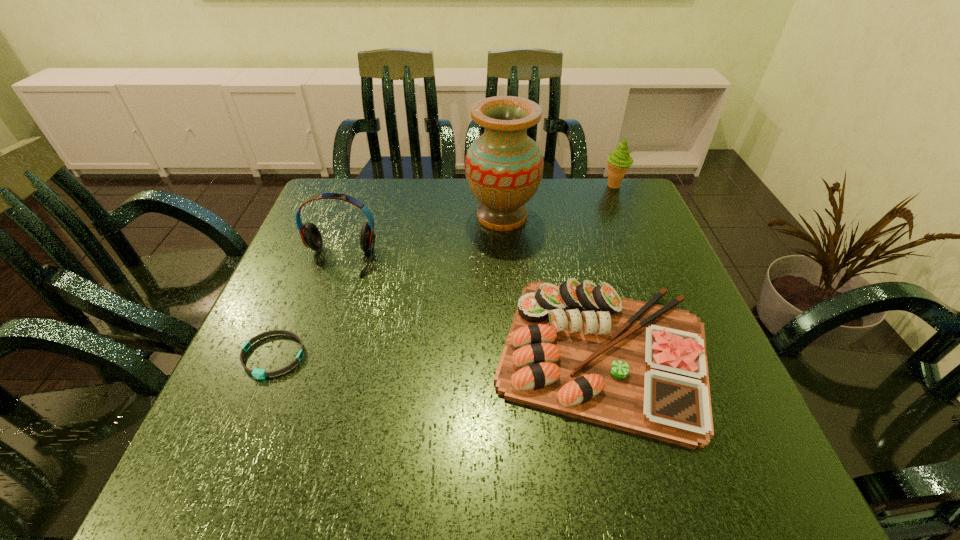
The height and width of the screenshot is (540, 960). What are the coordinates of `free location at the far edge` in the screenshot? It's located at (473, 207).

You are a GUI agent. You are given a task and a screenshot of the screen. Output one action in this format:
    pyautogui.click(x=<x>, y=<y>)
    Task: Click on the free space at the near edge of the desktop
    
    Given the screenshot: What is the action you would take?
    [418, 489]

Where is `vacant space at the left edge of the desktop`? vacant space at the left edge of the desktop is located at coordinates (245, 389).

In the image, there is a desktop. At what (x,y) coordinates should I click in order to perform the action: click on blank space at the right edge. Please return your answer as a coordinate pair (x, y). The image size is (960, 540). Looking at the image, I should click on (624, 276).

Locate an element on the screen. This screenshot has width=960, height=540. free space at the far left corner of the desktop is located at coordinates (331, 187).

At what (x,y) coordinates should I click in order to perform the action: click on vacant region at the near left corner of the desktop. Please return your answer as a coordinate pair (x, y). Image resolution: width=960 pixels, height=540 pixels. Looking at the image, I should click on (252, 482).

The height and width of the screenshot is (540, 960). What are the coordinates of `free space at the far right corner of the desktop` in the screenshot? It's located at (650, 212).

Find the location of a particular element. This screenshot has width=960, height=540. free area in between the farthest object and the third nearest object is located at coordinates (477, 222).

What are the coordinates of `free space between the third farthest object and the vase` in the screenshot? It's located at click(420, 238).

The width and height of the screenshot is (960, 540). I want to click on free space between the platter and the wristband, so [x=438, y=355].